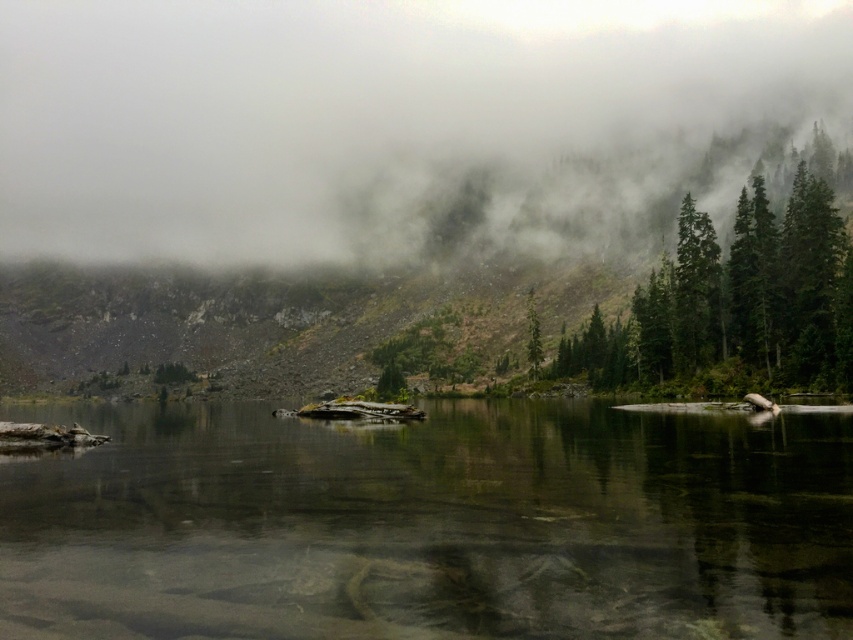
Question: Which point is farther to the camera?

Choices:
 (A) (602, 368)
 (B) (564, 403)
 (C) (531, 292)

Answer: (C)

Question: Does clear water at center have a lesser width compared to foggy misty forest at upper center?

Choices:
 (A) no
 (B) yes

Answer: (B)

Question: Does clear water at center have a lesser width compared to green matte tree at center?

Choices:
 (A) yes
 (B) no

Answer: (B)

Question: Does clear water at center come in front of green matte tree at center?

Choices:
 (A) no
 (B) yes

Answer: (B)

Question: Which point is closer to the camera?

Choices:
 (A) (532, 360)
 (B) (666, 348)
 (C) (306, 472)
 (D) (479, 154)

Answer: (C)

Question: Based on their relative distances, which object is farther from the green matte trees at right?

Choices:
 (A) clear water at center
 (B) green matte tree at center

Answer: (B)